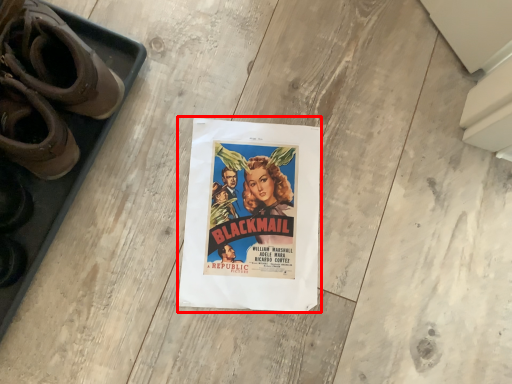
Question: In this image, where is poster (annotated by the red box) located relative to footwear?

Choices:
 (A) left
 (B) right

Answer: (B)